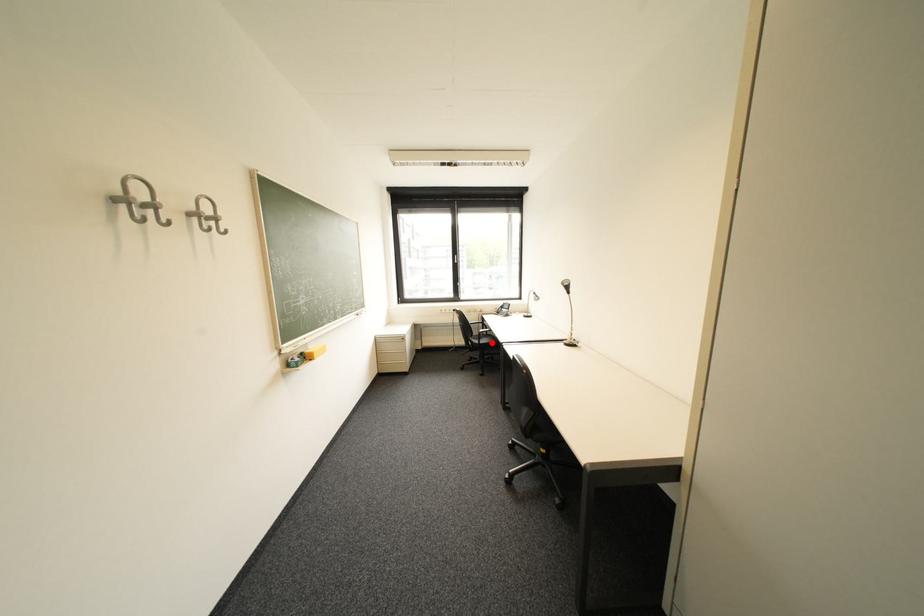
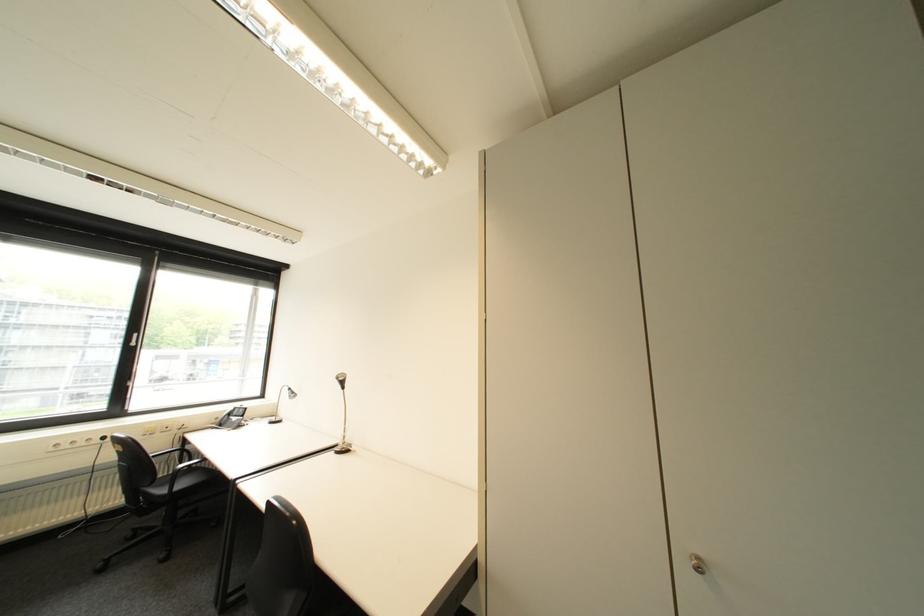
Question: I am providing you with two images of the same scene from different viewpoints. Given a red point in image1, look at the same physical point in image2. Is it:

Choices:
 (A) Closer to the viewpoint
 (B) Farther from the viewpoint

Answer: (A)